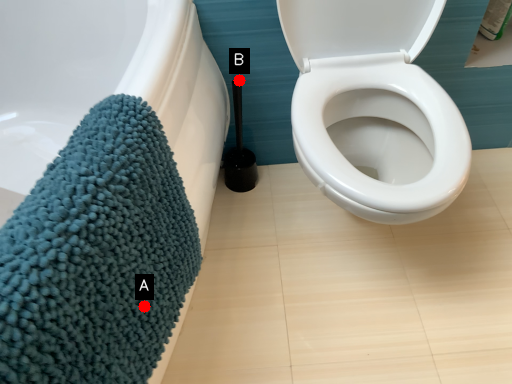
Question: Two points are circled on the image, labeled by A and B beside each circle. Which point is farther from the camera taking this photo?

Choices:
 (A) A is further
 (B) B is further

Answer: (B)